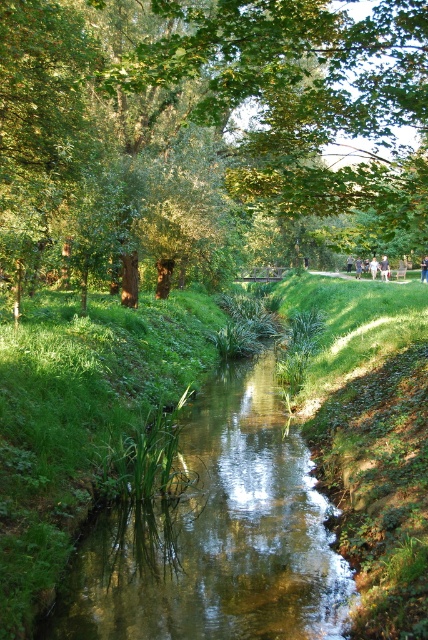
Does green leafy tree at upper center appear over clear water stream at center?

Yes.

Locate an element on the screen. green leafy tree at upper center is located at coordinates coord(199,120).

Looking at this image, can you confirm if clear water stream at center is shorter than light blue denim shorts at center?

Yes, clear water stream at center is shorter than light blue denim shorts at center.

I want to click on clear water stream at center, so click(216, 536).

Image resolution: width=428 pixels, height=640 pixels. In order to click on clear water stream at center in this screenshot , I will do `click(216, 536)`.

Between green leafy tree at upper center and blue denim jeans at center, which one appears on the right side from the viewer's perspective?

From the viewer's perspective, blue denim jeans at center appears more on the right side.

Is green leafy tree at upper center further to camera compared to blue denim jeans at center?

No, it is in front of blue denim jeans at center.

Where is `green leafy tree at upper center`? Image resolution: width=428 pixels, height=640 pixels. green leafy tree at upper center is located at coordinates (199, 120).